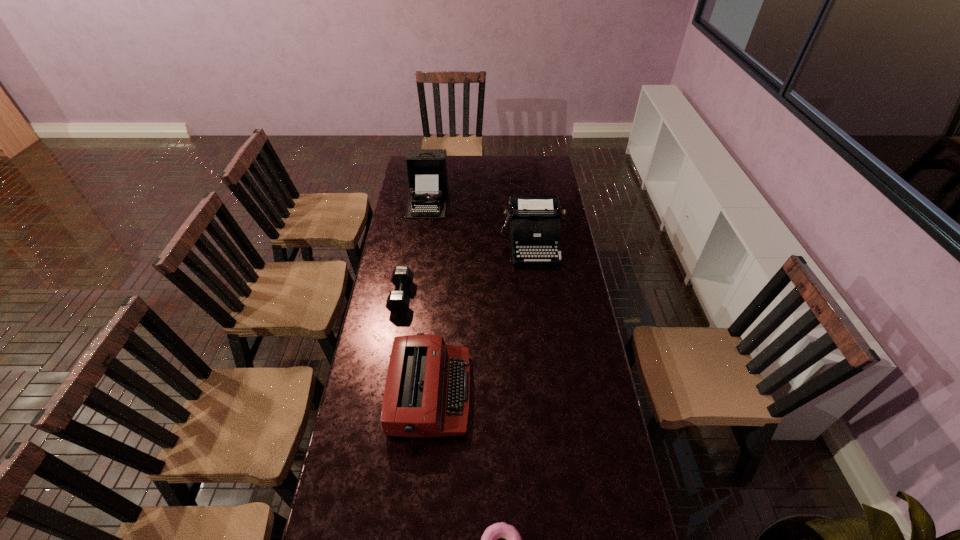
Find the location of `vacant area in the image that satisfies the following two spatial constraints: 1. on the typing side of the fourth shortest object; 2. on the typing side of the second nearest object`. vacant area in the image that satisfies the following two spatial constraints: 1. on the typing side of the fourth shortest object; 2. on the typing side of the second nearest object is located at coordinates (551, 393).

You are a GUI agent. You are given a task and a screenshot of the screen. Output one action in this format:
    pyautogui.click(x=<x>, y=<y>)
    Task: Click on the free space that satisfies the following two spatial constraints: 1. on the typing side of the second tallest typewriter; 2. on the typing side of the third tallest object
    The width and height of the screenshot is (960, 540).
    Given the screenshot: What is the action you would take?
    pyautogui.click(x=551, y=393)